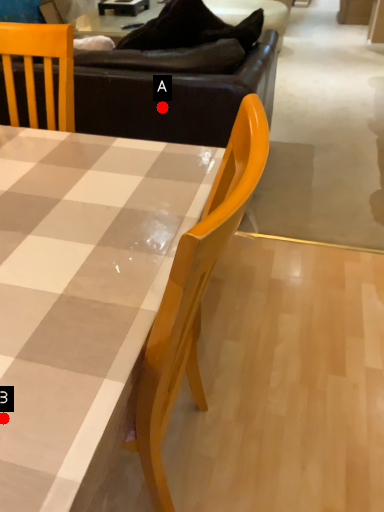
Question: Two points are circled on the image, labeled by A and B beside each circle. Among these points, which one is nearest to the camera?

Choices:
 (A) A is closer
 (B) B is closer

Answer: (B)